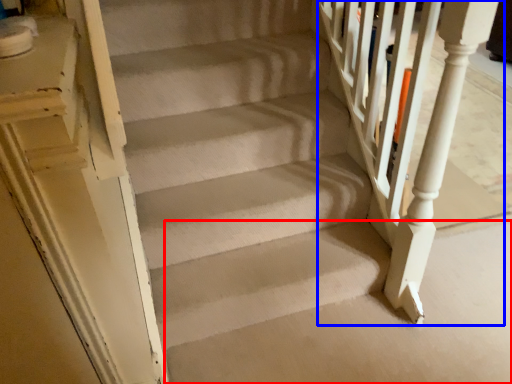
Question: Which of the following is the farthest to the observer, concrete (highlighted by a red box) or rail (highlighted by a blue box)?

Choices:
 (A) concrete
 (B) rail

Answer: (A)